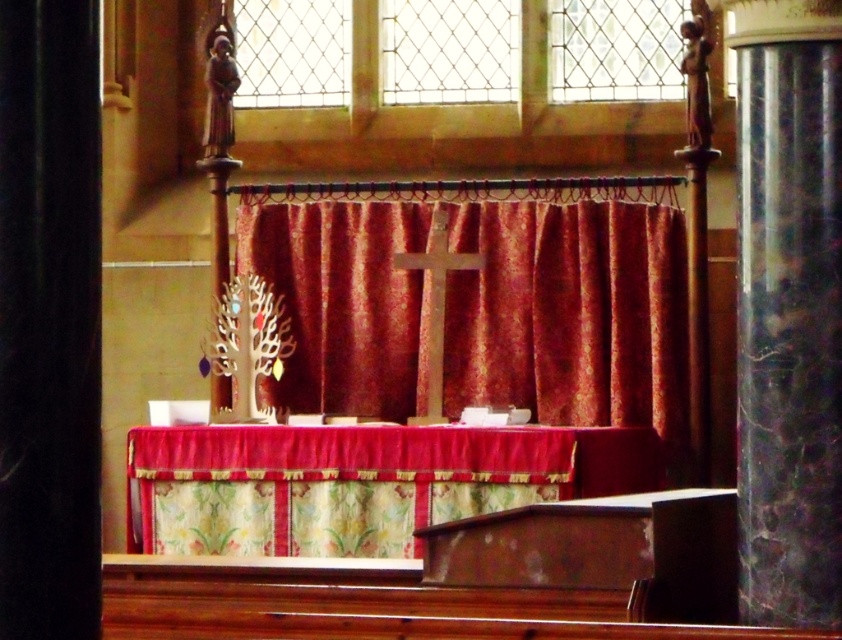
You are an interior designer planning to place a new sculpture in this church interior. You need to ensure that the sculpture will be visible from the entrance without obstruction. Given the positions of the marble column at right and the floral fabric table at center, which object might block the view if placed in front of it?

The marble column at right is positioned over the floral fabric table at center, so placing the sculpture in front of the marble column at right would block the view from the entrance.

You are an interior designer planning to replace the velvet red curtain at center and the floral fabric table at center with new items. If you want to maintain the current size ratio between them, which object should you make larger when designing the new items?

The velvet red curtain at center should be made larger than the floral fabric table at center to maintain the current size ratio between them.

You are an interior designer planning to place a 10cm wide decorative item on the altar. The velvet red curtain at center and the floral fabric table at center are both in the way. Which object should you move to make space?

The velvet red curtain at center is thinner than the floral fabric table at center, so moving the velvet red curtain at center would require less space to move aside, making it easier to create space for the decorative item.